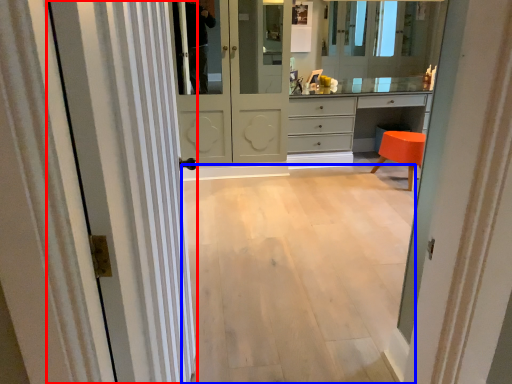
Question: Which object is closer to the camera taking this photo, door (highlighted by a red box) or corridor (highlighted by a blue box)?

Choices:
 (A) door
 (B) corridor

Answer: (A)